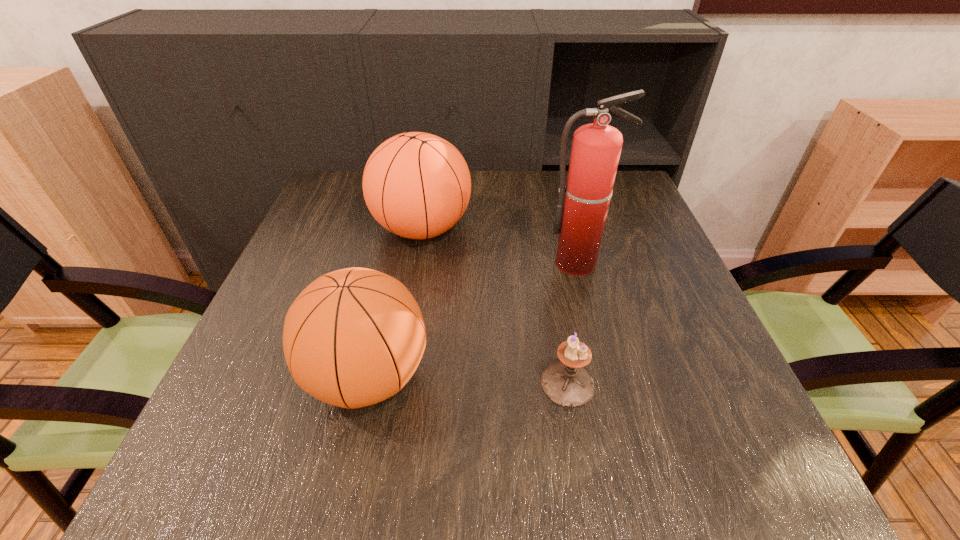
Where is `free spot between the candle holder and the nearer basketball`? The width and height of the screenshot is (960, 540). free spot between the candle holder and the nearer basketball is located at coordinates (468, 381).

Image resolution: width=960 pixels, height=540 pixels. I want to click on free spot between the candle holder and the tallest object, so 573,323.

In order to click on empty space between the shortest object and the nearer basketball in this screenshot , I will do `click(468, 381)`.

Where is `free space between the candle holder and the nearer basketball`? free space between the candle holder and the nearer basketball is located at coordinates (468, 381).

In order to click on unoccupied position between the fire extinguisher and the shortest object in this screenshot , I will do `click(573, 323)`.

Identify the location of free space between the farther basketball and the fire extinguisher. The height and width of the screenshot is (540, 960). (500, 246).

The width and height of the screenshot is (960, 540). Find the location of `free area in between the fire extinguisher and the nearer basketball`. free area in between the fire extinguisher and the nearer basketball is located at coordinates (473, 320).

Locate an element on the screen. object that is the closest to the nearer basketball is located at coordinates (567, 384).

Where is `object that is the third closest to the tallest object`? object that is the third closest to the tallest object is located at coordinates (354, 337).